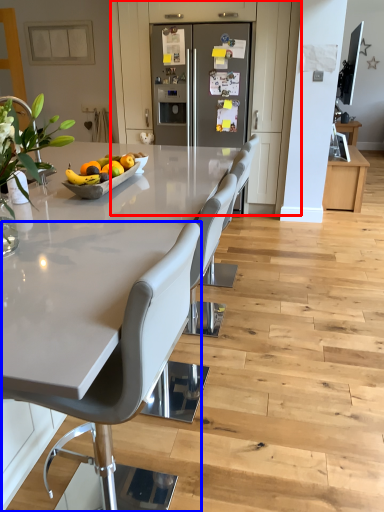
Question: Which object is closer to the camera taking this photo, cabinetry (highlighted by a red box) or chair (highlighted by a blue box)?

Choices:
 (A) cabinetry
 (B) chair

Answer: (B)